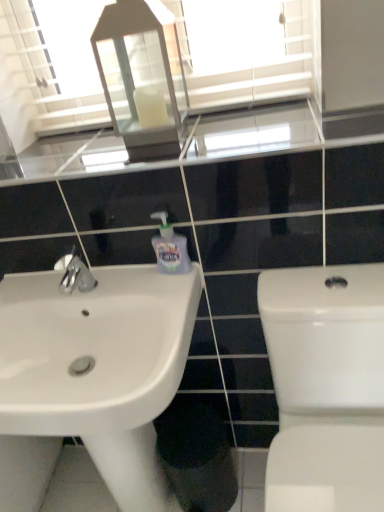
Question: Considering the relative sizes of white glass lantern at upper center and white glossy toilet at right in the image provided, is white glass lantern at upper center bigger than white glossy toilet at right?

Choices:
 (A) yes
 (B) no

Answer: (B)

Question: Would you say white glossy toilet at right is part of white glass lantern at upper center's contents?

Choices:
 (A) no
 (B) yes

Answer: (A)

Question: Is white glass lantern at upper center at the left side of white glossy toilet at right?

Choices:
 (A) no
 (B) yes

Answer: (B)

Question: Considering the relative sizes of white glass lantern at upper center and white glossy toilet at right in the image provided, is white glass lantern at upper center taller than white glossy toilet at right?

Choices:
 (A) yes
 (B) no

Answer: (B)

Question: Does white glass lantern at upper center have a lesser width compared to white glossy toilet at right?

Choices:
 (A) no
 (B) yes

Answer: (B)

Question: Does white glass lantern at upper center appear on the right side of white glossy toilet at right?

Choices:
 (A) no
 (B) yes

Answer: (A)

Question: Is white glossy toilet at right at the left side of clear glass mirror at upper center?

Choices:
 (A) no
 (B) yes

Answer: (A)

Question: Can you confirm if white glossy toilet at right is positioned to the right of clear glass mirror at upper center?

Choices:
 (A) no
 (B) yes

Answer: (B)

Question: Can you confirm if white glossy toilet at right is bigger than clear glass mirror at upper center?

Choices:
 (A) no
 (B) yes

Answer: (B)

Question: Is white glossy toilet at right not close to clear glass mirror at upper center?

Choices:
 (A) yes
 (B) no

Answer: (B)

Question: From the image's perspective, is white glossy toilet at right above clear glass mirror at upper center?

Choices:
 (A) yes
 (B) no

Answer: (B)

Question: Is clear glass mirror at upper center completely or partially inside white glossy toilet at right?

Choices:
 (A) yes
 (B) no

Answer: (B)

Question: Considering the relative positions of clear glass mirror at upper center and white glossy toilet at right in the image provided, is clear glass mirror at upper center behind white glossy toilet at right?

Choices:
 (A) no
 (B) yes

Answer: (B)